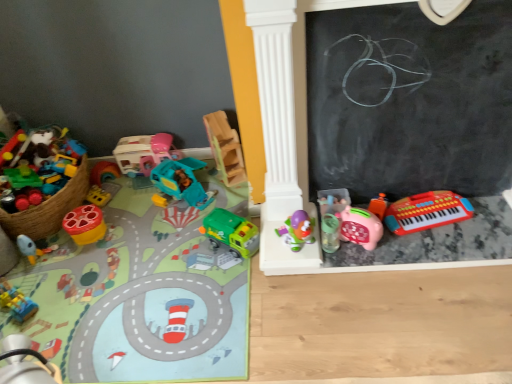
At what (x,y) coordinates should I click in order to perform the action: click on blank area to the left of translucent plastic playhouse at center-left, the eighth toy from the right. Please return your answer as a coordinate pair (x, y). The image size is (512, 384). Looking at the image, I should click on (116, 186).